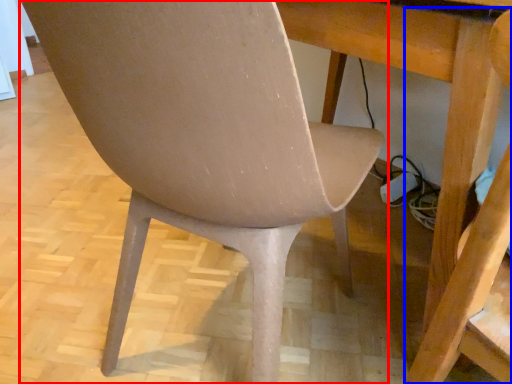
Question: Which object is closer to the camera taking this photo, chair (highlighted by a red box) or swivel chair (highlighted by a blue box)?

Choices:
 (A) chair
 (B) swivel chair

Answer: (B)